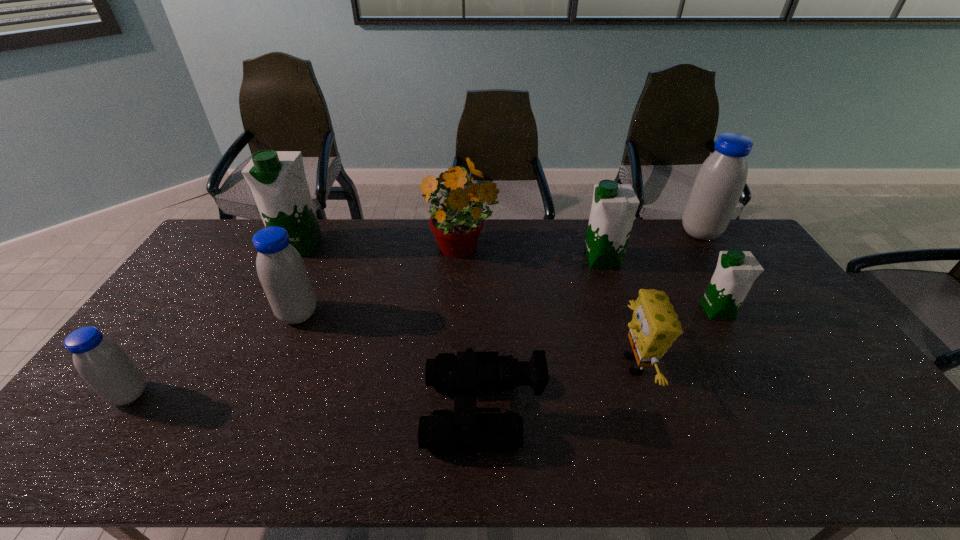
What are the coordinates of `the nearest soya milk` in the screenshot? It's located at (103, 364).

At what (x,y) coordinates should I click in order to perform the action: click on the smallest blue soya milk. Please return your answer as a coordinate pair (x, y). Looking at the image, I should click on (103, 364).

What are the coordinates of `yellow sponge` in the screenshot? It's located at (655, 325).

Find the location of a particular element. The width and height of the screenshot is (960, 540). binoculars is located at coordinates (469, 372).

Locate an element on the screen. free space located 0.070m on the front of the biggest blue soya milk is located at coordinates pyautogui.click(x=716, y=256).

Where is `free space located 0.100m on the front-facing side of the biggest green soya milk`? free space located 0.100m on the front-facing side of the biggest green soya milk is located at coordinates (283, 278).

Locate an element on the screen. The width and height of the screenshot is (960, 540). vacant space located on the left of the flowerpot is located at coordinates (336, 251).

Locate an element on the screen. This screenshot has height=540, width=960. vacant space located 0.080m on the front-facing side of the second smallest green soya milk is located at coordinates (561, 260).

At what (x,y) coordinates should I click in order to perform the action: click on free space located on the front-facing side of the second smallest green soya milk. Please return your answer as a coordinate pair (x, y). This screenshot has width=960, height=540. Looking at the image, I should click on (555, 260).

Find the location of a particular element. The height and width of the screenshot is (540, 960). free space located 0.120m on the front-facing side of the second smallest green soya milk is located at coordinates (549, 260).